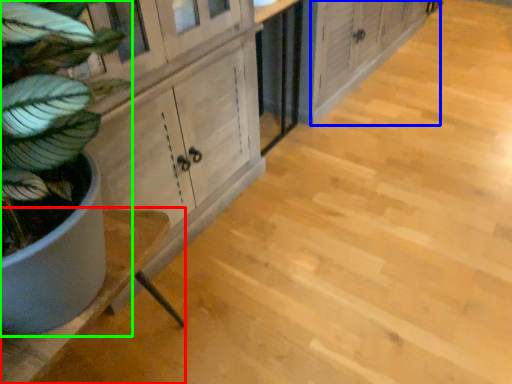
Question: Considering the real-world distances, which object is farthest from counter (highlighted by a red box)? cabinetry (highlighted by a blue box) or houseplant (highlighted by a green box)?

Choices:
 (A) cabinetry
 (B) houseplant

Answer: (A)